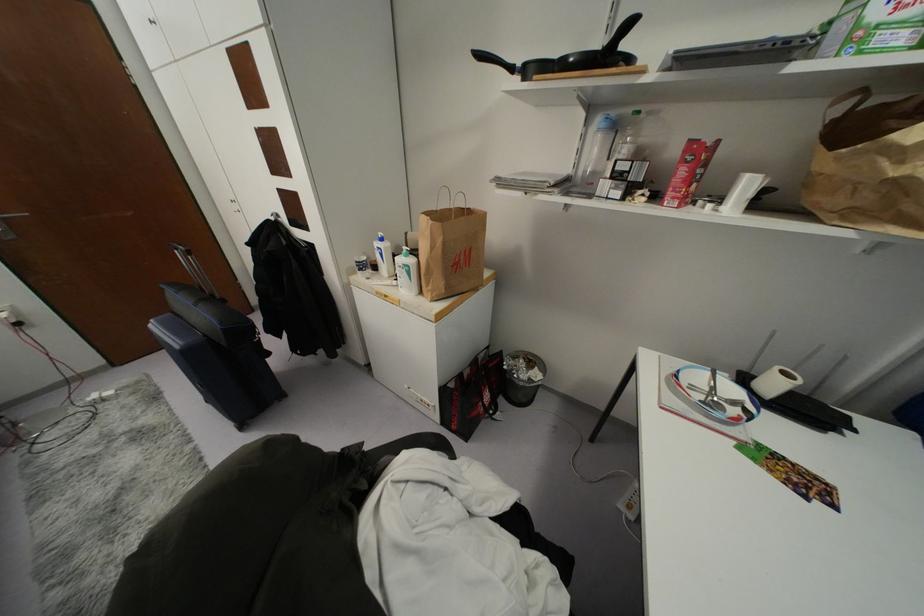
Where would you lift the black pan handle? Please return your answer as a coordinate pair (x, y).

(622, 31)